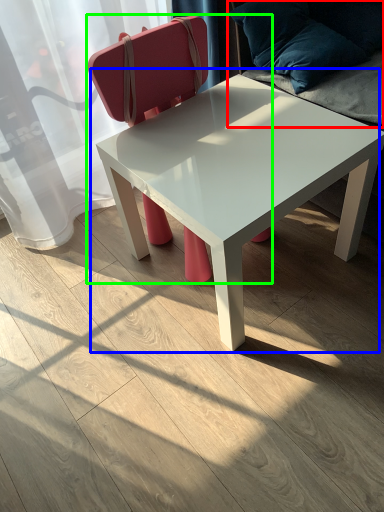
Question: Based on their relative distances, which object is farther from swivel chair (highlighted by a red box)? Choose from coffee table (highlighted by a blue box) and chair (highlighted by a green box).

Choices:
 (A) coffee table
 (B) chair

Answer: (B)